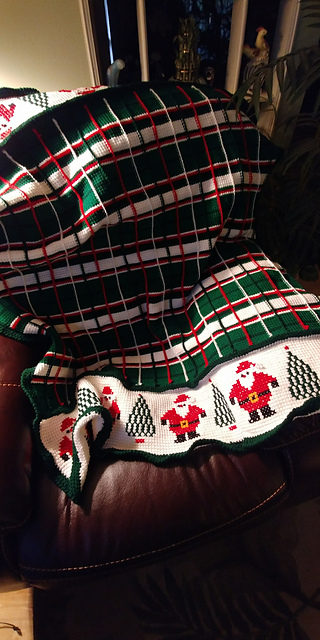
This screenshot has width=320, height=640. Identify the location of bourgandy seat. (148, 512).